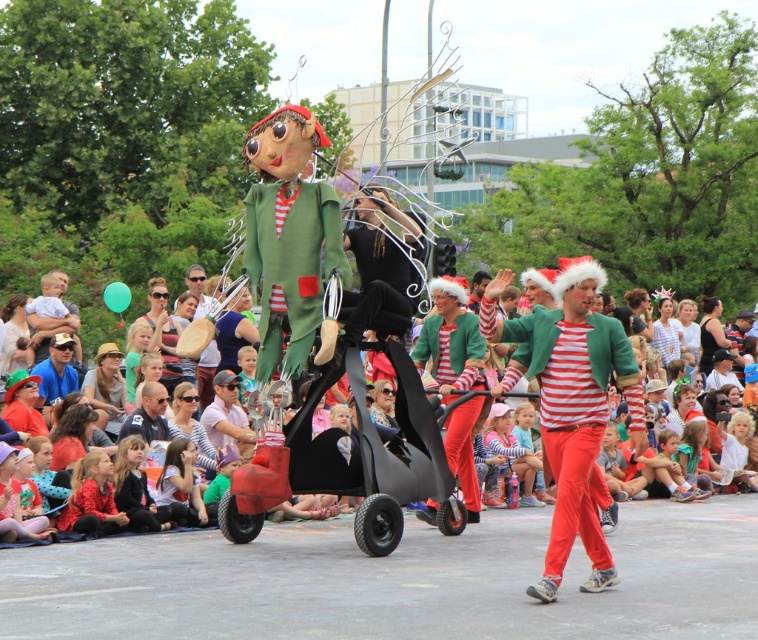
You are a photographer at the event and want to capture both the striped cotton shirt at center and the brushed metal drum at center in the same frame. Based on their positions, which object should you position closer to the left side of your camera viewfinder to include both?

The striped cotton shirt at center is to the right of the brushed metal drum at center, so you should position the brushed metal drum at center closer to the left side of your camera viewfinder to include both in the frame.

You are standing at the point with coordinates point (204, 387) and want to walk to the point with coordinates point (625, 403). Which direction should you move to get closer to your destination?

To reach point (625, 403) from point (204, 387), you should move upwards because point (625, 403) is in front of point (204, 387).